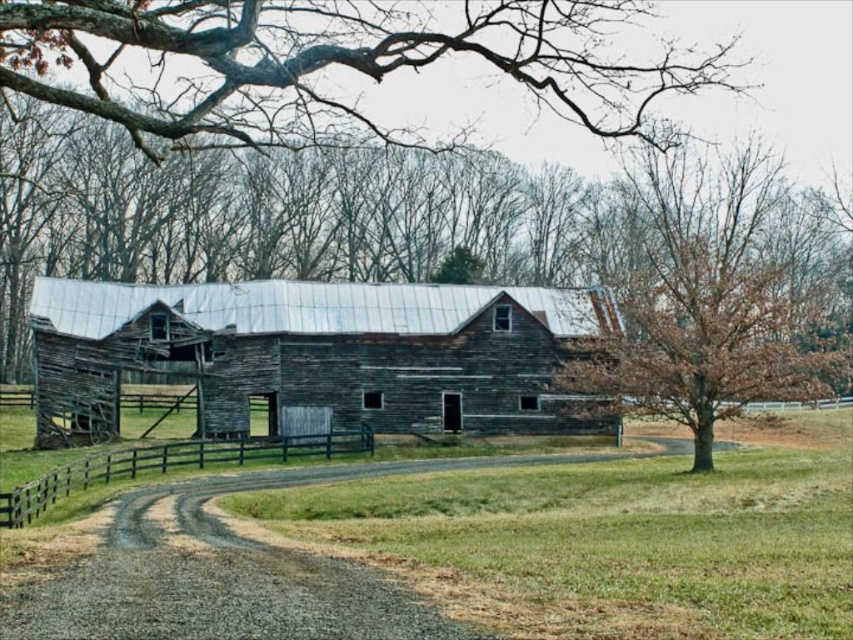
You are a farmer planning to drive a tractor with a 3.5 meter width through the path between the weathered wood barn at center and the gray gravel road at lower left. Can the tractor pass through without touching either the barn or the road?

The weathered wood barn at center might be wider than gray gravel road at lower left. Since the tractor is 3.5 meters wide, it is uncertain whether there is enough space between them. The farmer should measure the distance before attempting to pass.

You are a painter standing at the entrance of the pasture. You want to paint both the weathered wood barn at center and the black wooden fence at lower center. Which object should you paint first if you want to start with the taller one?

The weathered wood barn at center has a greater height compared to the black wooden fence at lower center, so you should paint the weathered wood barn at center first.